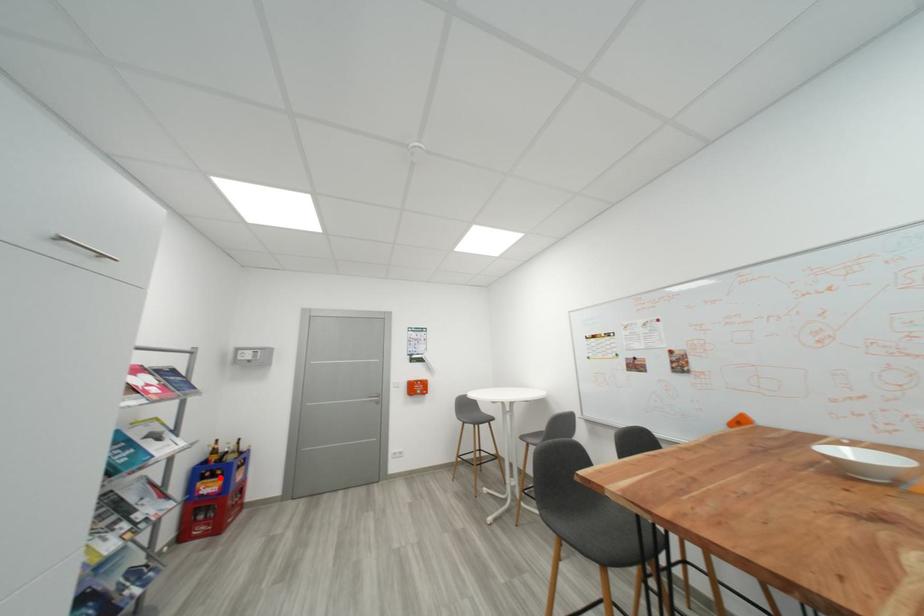
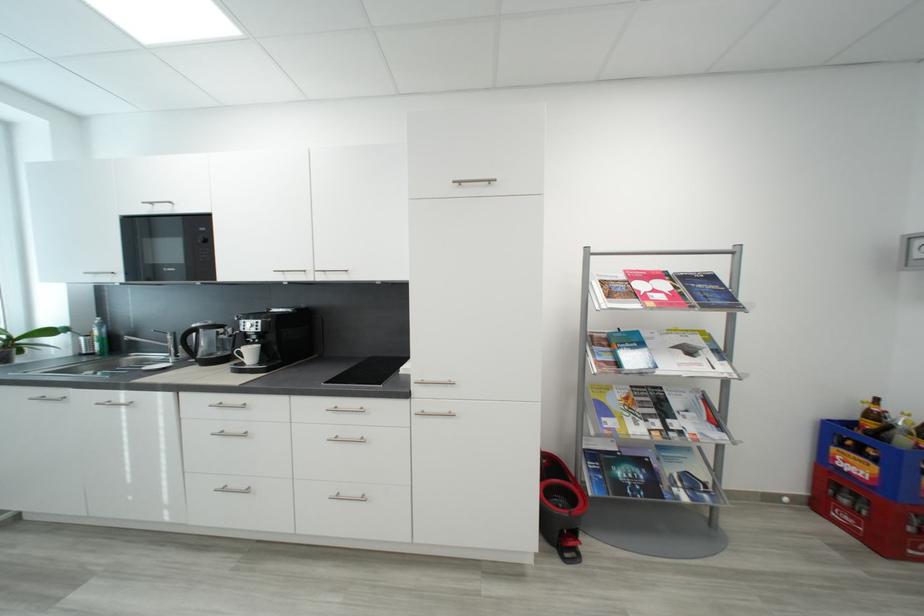
The point at the highlighted location is marked in the first image. Where is the corresponding point in the second image?

(867, 454)